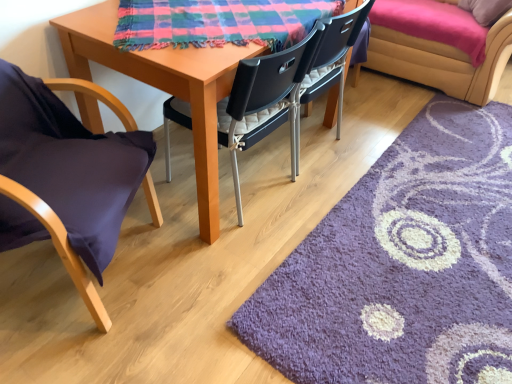
Where is `plaid fabric at center`? The image size is (512, 384). plaid fabric at center is located at coordinates (218, 22).

What is the approximate width of purple fabric chair at left, the 2th chair positioned from the right?

purple fabric chair at left, the 2th chair positioned from the right, is 24.02 inches wide.

Measure the distance between purple fabric chair at left, the 2th chair positioned from the right, and camera.

They are 3.58 feet apart.

In order to face velvet yellow couch at upper right, should I rotate leftwards or rightwards?

Turn right approximately 23.222 degrees to face it.

You are a GUI agent. You are given a task and a screenshot of the screen. Output one action in this format:
    pyautogui.click(x=<x>, y=<y>)
    Task: Click on the velvet yellow couch at upper right
    
    Given the screenshot: What is the action you would take?
    pyautogui.click(x=443, y=61)

Find the location of a particular element. The height and width of the screenshot is (384, 512). plaid fabric at center is located at coordinates (218, 22).

Is plaid fabric at center not near velvet yellow couch at upper right?

Yes, plaid fabric at center is far from velvet yellow couch at upper right.

Does plaid fabric at center appear on the right side of velvet yellow couch at upper right?

No, plaid fabric at center is not to the right of velvet yellow couch at upper right.

Considering the sizes of objects plaid fabric at center and velvet yellow couch at upper right in the image provided, who is thinner, plaid fabric at center or velvet yellow couch at upper right?

plaid fabric at center is thinner.

From the picture: Which of these two, plaid fabric at center or velvet yellow couch at upper right, is smaller?

plaid fabric at center is smaller.

Between velvet yellow couch at upper right and plaid fabric at center, which one has less height?

Standing shorter between the two is plaid fabric at center.

Is the position of velvet yellow couch at upper right more distant than that of plaid fabric at center?

Yes.

Would you say velvet yellow couch at upper right is outside plaid fabric at center?

Yes, velvet yellow couch at upper right is not within plaid fabric at center.

Is velvet yellow couch at upper right wider than plaid fabric at center?

Yes, velvet yellow couch at upper right is wider than plaid fabric at center.

Could you measure the distance between purple fabric chair at left, marked as the first chair in a left-to-right arrangement, and plaid fabric at center?

The distance of purple fabric chair at left, marked as the first chair in a left-to-right arrangement, from plaid fabric at center is 19.43 inches.

Is there a large distance between purple fabric chair at left, the 2th chair positioned from the right, and plaid fabric at center?

purple fabric chair at left, the 2th chair positioned from the right, is near plaid fabric at center, not far away.

Can you confirm if purple fabric chair at left, the 2th chair positioned from the right, is shorter than plaid fabric at center?

In fact, purple fabric chair at left, the 2th chair positioned from the right, may be taller than plaid fabric at center.

Is purple fabric chair at left, marked as the first chair in a left-to-right arrangement, at the right side of plaid fabric at center?

No.

The height and width of the screenshot is (384, 512). I want to click on couch that appears above the black plastic chair at center, acting as the first chair starting from the right (from the image's perspective), so click(x=443, y=61).

How much distance is there between black plastic chair at center, acting as the second chair starting from the left, and velvet yellow couch at upper right?

The distance of black plastic chair at center, acting as the second chair starting from the left, from velvet yellow couch at upper right is 28.48 inches.

Which is in front, black plastic chair at center, acting as the second chair starting from the left, or velvet yellow couch at upper right?

black plastic chair at center, acting as the second chair starting from the left, is in front.

Does point (341, 38) come farther from viewer compared to point (433, 69)?

No, (341, 38) is closer to viewer.

In order to click on blanket above the purple shaggy rug at lower right (from the image's perspective) in this screenshot , I will do `click(218, 22)`.

Would you say plaid fabric at center is to the left or to the right of purple shaggy rug at lower right in the picture?

In the image, plaid fabric at center appears on the left side of purple shaggy rug at lower right.

Can we say plaid fabric at center lies outside purple shaggy rug at lower right?

Yes, plaid fabric at center is located beyond the bounds of purple shaggy rug at lower right.

From the image's perspective, which one is positioned higher, plaid fabric at center or purple shaggy rug at lower right?

plaid fabric at center appears higher in the image.

Is the position of purple shaggy rug at lower right less distant than that of black plastic chair at center, acting as the second chair starting from the left?

That is True.

Are purple shaggy rug at lower right and black plastic chair at center, acting as the second chair starting from the left, making contact?

No, purple shaggy rug at lower right is not touching black plastic chair at center, acting as the second chair starting from the left.

Is black plastic chair at center, acting as the second chair starting from the left, at the back of purple shaggy rug at lower right?

That's not correct — purple shaggy rug at lower right is not looking away from black plastic chair at center, acting as the second chair starting from the left.

Can you confirm if purple shaggy rug at lower right is thinner than black plastic chair at center, acting as the second chair starting from the left?

In fact, purple shaggy rug at lower right might be wider than black plastic chair at center, acting as the second chair starting from the left.

From a real-world perspective, who is located higher, velvet yellow couch at upper right or purple fabric chair at left, marked as the first chair in a left-to-right arrangement?

From a 3D spatial view, purple fabric chair at left, marked as the first chair in a left-to-right arrangement, is above.

From the image's perspective, is velvet yellow couch at upper right located beneath purple fabric chair at left, the 2th chair positioned from the right?

Actually, velvet yellow couch at upper right appears above purple fabric chair at left, the 2th chair positioned from the right, in the image.

Is velvet yellow couch at upper right thinner than purple fabric chair at left, marked as the first chair in a left-to-right arrangement?

In fact, velvet yellow couch at upper right might be wider than purple fabric chair at left, marked as the first chair in a left-to-right arrangement.

What's the angular difference between velvet yellow couch at upper right and purple fabric chair at left, the 2th chair positioned from the right,'s facing directions?

The facing directions of velvet yellow couch at upper right and purple fabric chair at left, the 2th chair positioned from the right, are 115 degrees apart.

Find the location of a particular element. blanket below the velvet yellow couch at upper right (from the image's perspective) is located at coordinates (218, 22).

Where is `blanket above the velvet yellow couch at upper right (from a real-world perspective)`? The width and height of the screenshot is (512, 384). blanket above the velvet yellow couch at upper right (from a real-world perspective) is located at coordinates (218, 22).

Looking at the image, which one is located closer to velvet yellow couch at upper right, purple fabric chair at left, the 2th chair positioned from the right, or purple shaggy rug at lower right?

The object closer to velvet yellow couch at upper right is purple shaggy rug at lower right.

Based on their spatial positions, is black plastic chair at center, acting as the second chair starting from the left, or purple shaggy rug at lower right further from plaid fabric at center?

purple shaggy rug at lower right.

Based on their spatial positions, is plaid fabric at center or purple shaggy rug at lower right further from purple fabric chair at left, the 2th chair positioned from the right?

The object further to purple fabric chair at left, the 2th chair positioned from the right, is purple shaggy rug at lower right.

Looking at the image, which one is located closer to plaid fabric at center, purple shaggy rug at lower right or black plastic chair at center, acting as the first chair starting from the right?

Among the two, black plastic chair at center, acting as the first chair starting from the right, is located nearer to plaid fabric at center.

Looking at the image, which one is located further to black plastic chair at center, acting as the second chair starting from the left, plaid fabric at center or velvet yellow couch at upper right?

velvet yellow couch at upper right lies further to black plastic chair at center, acting as the second chair starting from the left, than the other object.

From the image, which object appears to be farther from velvet yellow couch at upper right, purple shaggy rug at lower right or black plastic chair at center, acting as the second chair starting from the left?

purple shaggy rug at lower right.

Looking at the image, which one is located closer to black plastic chair at center, acting as the first chair starting from the right, purple shaggy rug at lower right or purple fabric chair at left, marked as the first chair in a left-to-right arrangement?

purple fabric chair at left, marked as the first chair in a left-to-right arrangement, lies closer to black plastic chair at center, acting as the first chair starting from the right, than the other object.

When comparing their distances from purple fabric chair at left, the 2th chair positioned from the right, does purple shaggy rug at lower right or velvet yellow couch at upper right seem further?

velvet yellow couch at upper right is further to purple fabric chair at left, the 2th chair positioned from the right.

Locate an element on the screen. Image resolution: width=512 pixels, height=384 pixels. chair between plaid fabric at center and purple shaggy rug at lower right in the horizontal direction is located at coordinates (333, 52).

Identify the location of blanket between purple fabric chair at left, the 2th chair positioned from the right, and purple shaggy rug at lower right from left to right. (218, 22).

The width and height of the screenshot is (512, 384). I want to click on chair between plaid fabric at center and velvet yellow couch at upper right from left to right, so click(333, 52).

This screenshot has width=512, height=384. In order to click on mat situated between purple fabric chair at left, the 2th chair positioned from the right, and velvet yellow couch at upper right from left to right in this screenshot , I will do `click(403, 265)`.